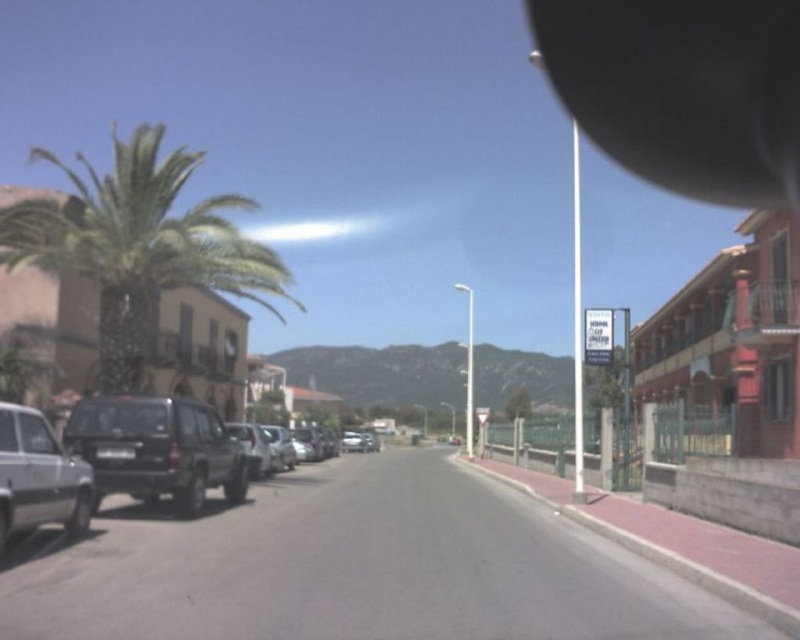
Question: Which point is farther to the camera?

Choices:
 (A) (8, 508)
 (B) (558, 84)
 (C) (102, 232)
 (D) (121, 449)

Answer: (B)

Question: In this image, where is green leafy palm tree at left located relative to dark gray matte suv at center-left?

Choices:
 (A) below
 (B) above

Answer: (B)

Question: Which object is farther from the camera taking this photo?

Choices:
 (A) silver metallic car at left
 (B) green leafy palm tree at left
 (C) black plastic license plate at center
 (D) silver metallic suv at left

Answer: (B)

Question: Can you confirm if green leafy palm tree at left is smaller than dark gray matte suv at center-left?

Choices:
 (A) yes
 (B) no

Answer: (B)

Question: Is black rubber view mirror at upper right wider than silver metallic car at left?

Choices:
 (A) yes
 (B) no

Answer: (A)

Question: Which of these objects is positioned farthest from the silver metallic suv at left?

Choices:
 (A) black rubber view mirror at upper right
 (B) black plastic license plate at center
 (C) dark gray matte suv at center-left

Answer: (A)